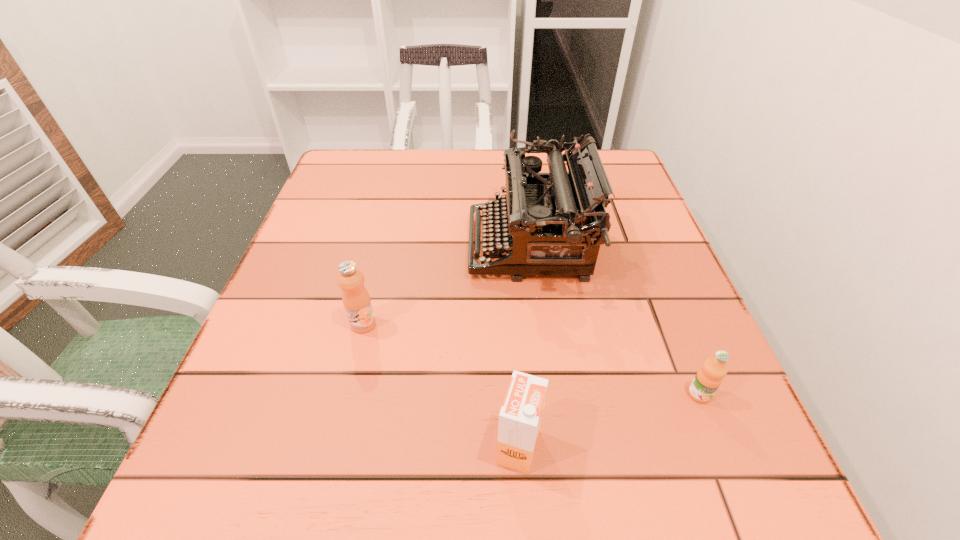
Identify the location of vacant space at the far edge of the desktop. (458, 156).

Identify the location of free space at the near edge of the desktop. The height and width of the screenshot is (540, 960). (412, 484).

This screenshot has width=960, height=540. I want to click on free space at the left edge of the desktop, so click(301, 332).

This screenshot has width=960, height=540. Identify the location of vacant space at the right edge of the desktop. (636, 208).

In order to click on blank space at the far left corner of the desktop in this screenshot , I will do `click(376, 172)`.

At what (x,y) coordinates should I click in order to perform the action: click on free space at the far right corner of the desktop. Please return your answer as a coordinate pair (x, y). This screenshot has height=540, width=960. Looking at the image, I should click on (614, 159).

At what (x,y) coordinates should I click in order to perform the action: click on vacant position at the near right corner of the desktop. Please return your answer as a coordinate pair (x, y). This screenshot has width=960, height=540. Looking at the image, I should click on (780, 494).

Locate an element on the screen. The image size is (960, 540). vacant area that lies between the third farthest object and the farthest object is located at coordinates (614, 320).

Identify the location of blank region between the second farthest object and the shortest object. The height and width of the screenshot is (540, 960). (531, 359).

I want to click on vacant point located between the nearest object and the tallest object, so click(524, 346).